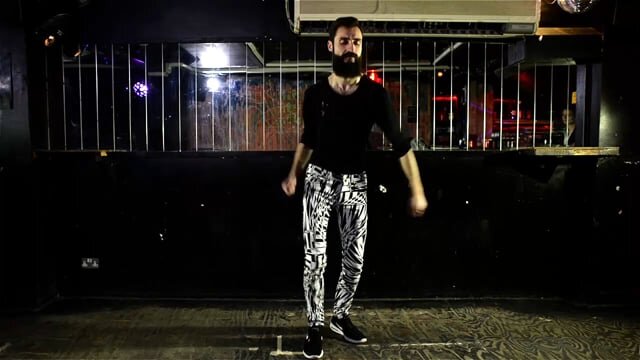
What are the coordinates of `uk style electrical plug socket` in the screenshot? It's located at pyautogui.click(x=84, y=262), pyautogui.click(x=95, y=259).